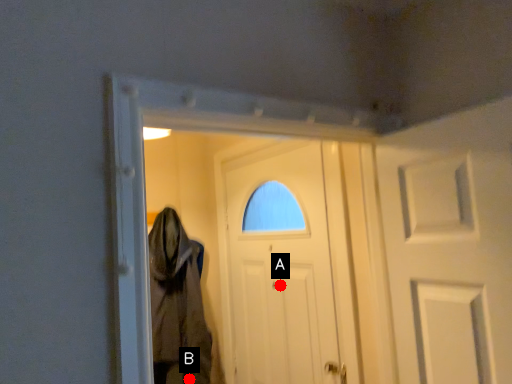
Question: Two points are circled on the image, labeled by A and B beside each circle. Which point is closer to the camera taking this photo?

Choices:
 (A) A is closer
 (B) B is closer

Answer: (A)